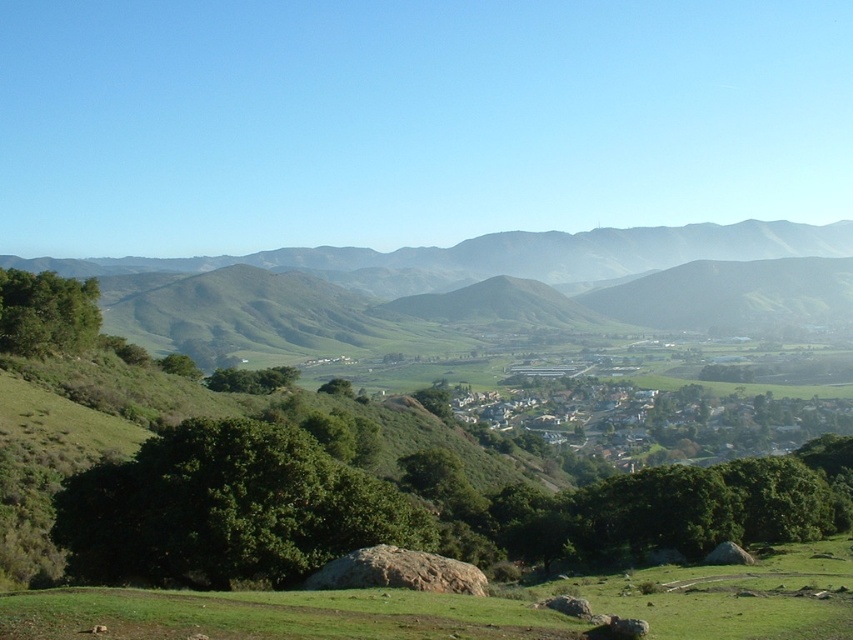
You are standing at the point marked as point (425, 278) in the image. What is the name of the object located exactly at this coordinate?

The object located at point (425, 278) is the green grassy hillside at center.

Based on the photo, you are planning to set up a picnic area. You have two options for locations in the image. The first is the green grassy hillside at center, and the second is the green grassy field at lower center. Which location would provide more space for your picnic setup?

The green grassy hillside at center is bigger than the green grassy field at lower center, so it would provide more space for the picnic setup.